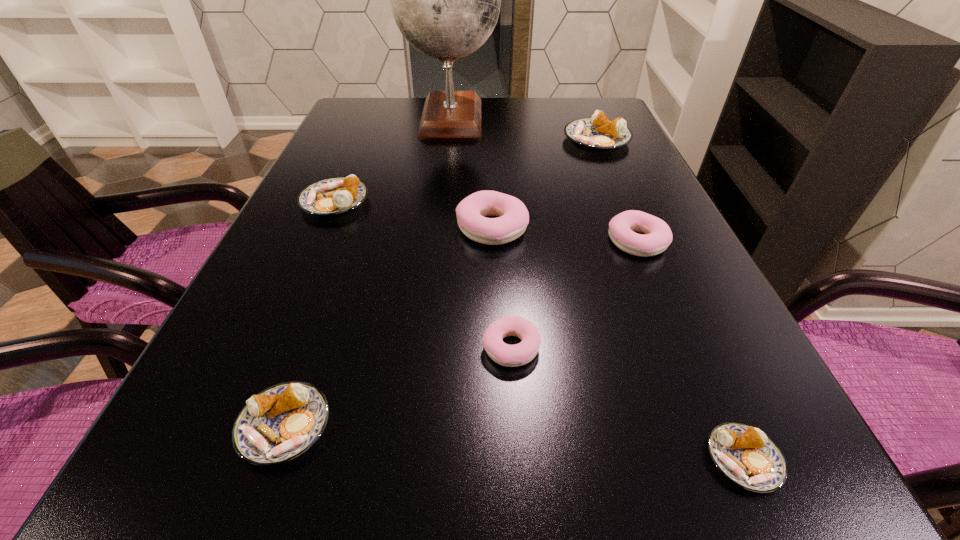
At what (x,y) coordinates should I click in order to perform the action: click on the tallest object. Please return your answer as a coordinate pair (x, y). This screenshot has width=960, height=540. Looking at the image, I should click on (446, 0).

This screenshot has width=960, height=540. I want to click on the farthest brown pastry, so click(x=599, y=133).

Find the location of `the biggest brown pastry`. the biggest brown pastry is located at coordinates (599, 133).

I want to click on the biggest pink pastry, so click(x=513, y=217).

I want to click on the second farthest brown pastry, so click(x=336, y=195).

I want to click on the second biggest pink pastry, so click(x=622, y=227).

What are the coordinates of `the third biggest brown pastry` in the screenshot? It's located at 282,422.

This screenshot has width=960, height=540. In order to click on the smallest pink pastry in this screenshot , I will do `click(522, 353)`.

Image resolution: width=960 pixels, height=540 pixels. Identify the location of the sixth farthest object. (x=522, y=353).

In order to click on the smallest brown pastry in this screenshot , I will do `click(746, 456)`.